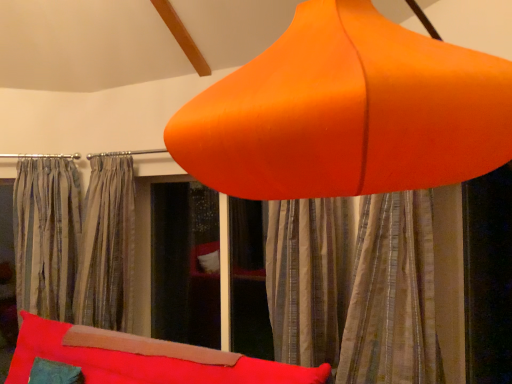
Question: Can you confirm if orange matte lampshade at upper center is taller than silky gray curtains at center, the second curtain when ordered from right to left?

Choices:
 (A) no
 (B) yes

Answer: (A)

Question: Does orange matte lampshade at upper center turn towards silky gray curtains at center, the second curtain when ordered from right to left?

Choices:
 (A) no
 (B) yes

Answer: (A)

Question: From the image's perspective, would you say orange matte lampshade at upper center is shown under silky gray curtains at center, placed as the 1th curtain when sorted from back to front?

Choices:
 (A) yes
 (B) no

Answer: (B)

Question: Is the depth of orange matte lampshade at upper center greater than that of silky gray curtains at center, the 1th curtain in the left-to-right sequence?

Choices:
 (A) no
 (B) yes

Answer: (A)

Question: Considering the relative sizes of orange matte lampshade at upper center and silky gray curtains at center, the second curtain when ordered from right to left, in the image provided, is orange matte lampshade at upper center shorter than silky gray curtains at center, the second curtain when ordered from right to left,?

Choices:
 (A) yes
 (B) no

Answer: (A)

Question: Looking at their shapes, would you say orange matte lampshade at upper center is wider or thinner than velvet red bean bag at lower center?

Choices:
 (A) thin
 (B) wide

Answer: (B)

Question: Relative to velvet red bean bag at lower center, is orange matte lampshade at upper center in front or behind?

Choices:
 (A) behind
 (B) front

Answer: (B)

Question: Is orange matte lampshade at upper center bigger or smaller than velvet red bean bag at lower center?

Choices:
 (A) big
 (B) small

Answer: (B)

Question: Is point (339, 122) positioned closer to the camera than point (83, 344)?

Choices:
 (A) closer
 (B) farther

Answer: (A)

Question: Considering the relative positions of orange matte lampshade at upper center and striped fabric curtain at center, the second curtain viewed from the left, in the image provided, is orange matte lampshade at upper center to the left or to the right of striped fabric curtain at center, the second curtain viewed from the left,?

Choices:
 (A) right
 (B) left

Answer: (B)

Question: Is orange matte lampshade at upper center in front of or behind striped fabric curtain at center, the 1th curtain viewed from the right, in the image?

Choices:
 (A) behind
 (B) front

Answer: (B)

Question: In terms of size, does orange matte lampshade at upper center appear bigger or smaller than striped fabric curtain at center, the second curtain viewed from the left?

Choices:
 (A) small
 (B) big

Answer: (B)

Question: From a real-world perspective, is orange matte lampshade at upper center above or below striped fabric curtain at center, marked as the 2th curtain in a back-to-front arrangement?

Choices:
 (A) above
 (B) below

Answer: (A)

Question: Does point (310, 256) appear closer or farther from the camera than point (154, 364)?

Choices:
 (A) closer
 (B) farther

Answer: (B)

Question: Relative to velvet red bean bag at lower center, is striped fabric curtain at center, the 1th curtain viewed from the right, in front or behind?

Choices:
 (A) behind
 (B) front

Answer: (A)